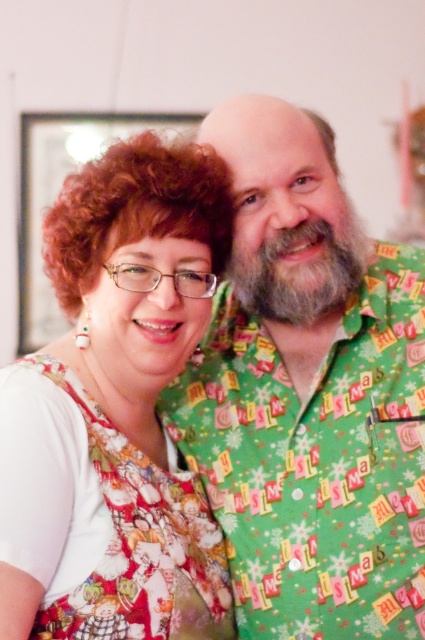
Is green fabric shirt at center to the right of matte floral dress at left from the viewer's perspective?

Yes, green fabric shirt at center is to the right of matte floral dress at left.

Is green fabric shirt at center thinner than matte floral dress at left?

No.

Where is `green fabric shirt at center`? Image resolution: width=425 pixels, height=640 pixels. green fabric shirt at center is located at coordinates (308, 394).

Where is `green fabric shirt at center`? Image resolution: width=425 pixels, height=640 pixels. green fabric shirt at center is located at coordinates (308, 394).

The height and width of the screenshot is (640, 425). What do you see at coordinates (116, 410) in the screenshot?
I see `matte floral dress at left` at bounding box center [116, 410].

Is point (119, 390) positioned behind point (285, 314)?

That is True.

Who is more forward, (x=99, y=332) or (x=300, y=230)?

Point (x=300, y=230) is in front.

Identify the location of matte floral dress at left. Image resolution: width=425 pixels, height=640 pixels. (116, 410).

From the picture: Who is positioned more to the left, green fabric shirt at center or white fluffy beard at center?

From the viewer's perspective, green fabric shirt at center appears more on the left side.

Is point (334, 230) closer to camera compared to point (294, 320)?

Yes, point (334, 230) is in front of point (294, 320).

What are the coordinates of `green fabric shirt at center` in the screenshot? It's located at (308, 394).